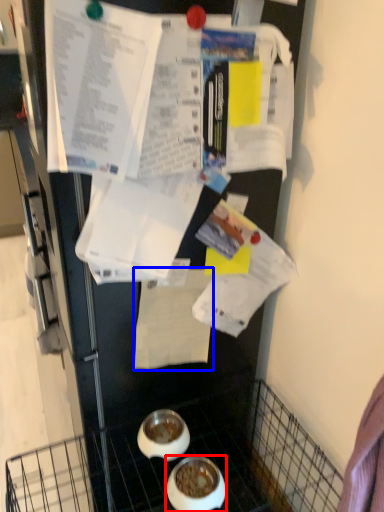
Question: Which of the following is the closest to the observer, bowl (highlighted by a red box) or paper (highlighted by a blue box)?

Choices:
 (A) bowl
 (B) paper

Answer: (A)